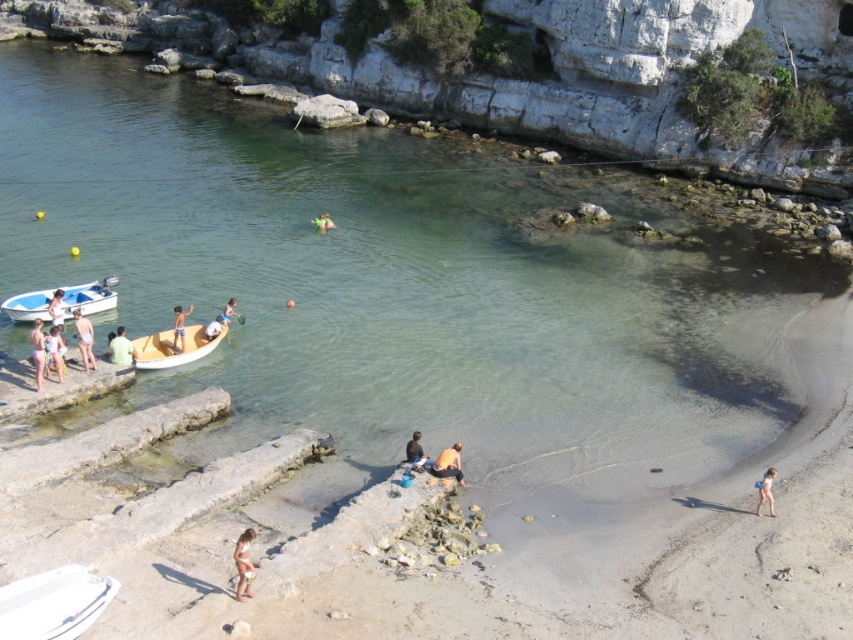
Question: Which of the following is the closest to the observer?

Choices:
 (A) light blue swimsuit at center
 (B) beige fabric bikini at lower center
 (C) light brown wooden boat at left

Answer: (B)

Question: Which object appears closest to the camera in this image?

Choices:
 (A) light brown wooden paddleboard at center-left
 (B) light pink swimsuit at lower left

Answer: (B)

Question: Is tan skin person at lower center wider than light pink fabric bikini at lower left?

Choices:
 (A) no
 (B) yes

Answer: (B)

Question: Is white plastic boat at left above light brown wooden paddleboard at center-left?

Choices:
 (A) yes
 (B) no

Answer: (A)

Question: Based on their relative distances, which object is farther from the wooden boat at center-left?

Choices:
 (A) light brown wooden boat at left
 (B) light brown wooden boat at center
 (C) light blue swimsuit at center

Answer: (C)

Question: Can you confirm if white plastic boat at left is positioned above wooden boat at center-left?

Choices:
 (A) yes
 (B) no

Answer: (A)